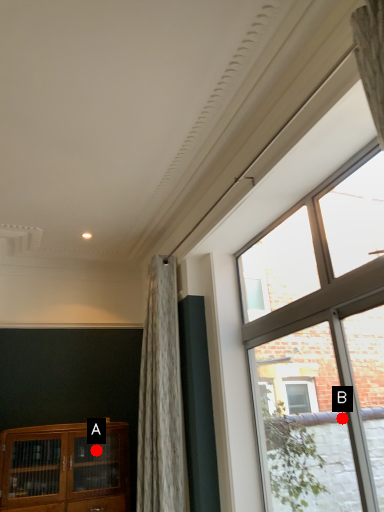
Question: Two points are circled on the image, labeled by A and B beside each circle. Which point is farther from the camera taking this photo?

Choices:
 (A) A is further
 (B) B is further

Answer: (A)